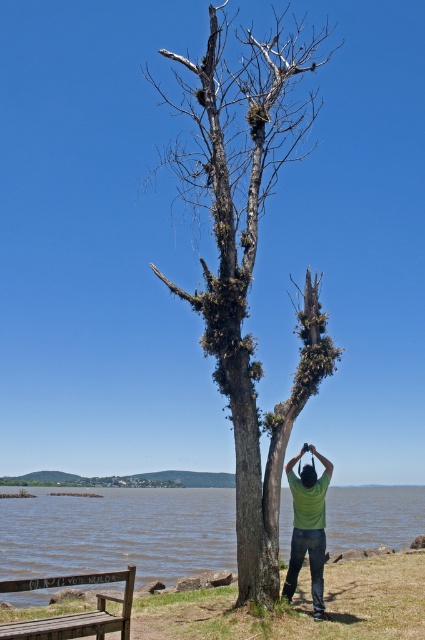
You are an artist planning to sketch the scene. You notice the green matte shirt at center and the green matte head at center. Which one should you draw wider in your sketch to accurately represent their sizes?

The green matte shirt at center should be drawn wider than the green matte head at center since the shirt is wider than the head according to the description.

You are an artist observing the scene. You want to paint the person wearing the green matte shirt at center and the green matte head at center. Which one should you paint first if you want to start with the larger object?

You should paint the green matte shirt at center first because it is larger in size than the green matte head at center.

You are a photographer planning to take a portrait of the person in the green matte shirt at center. You want to include the wooden bench at lower left in the background for context. Since you can only focus on one subject clearly, which object should you focus on to ensure the other remains recognizable but slightly blurred?

You should focus on the green matte shirt at center because the wooden bench at lower left is smaller than the green matte shirt at center, so focusing on the larger subject will keep the smaller one in acceptable focus while allowing for a blurred background effect.